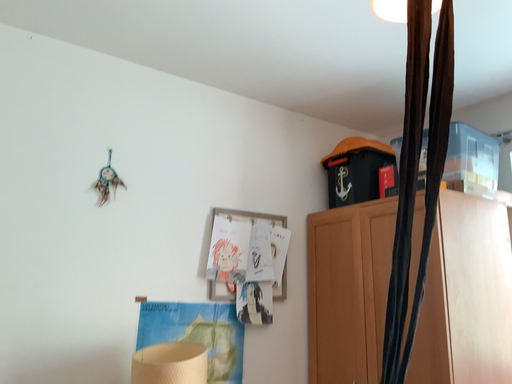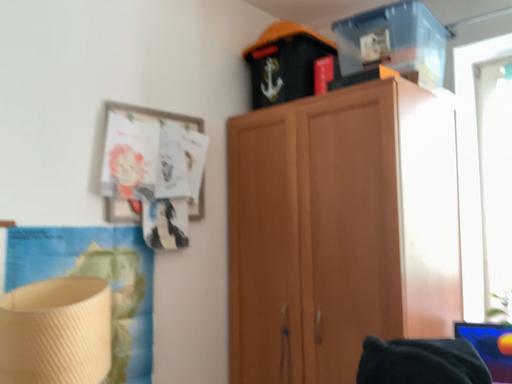
Question: Which way did the camera rotate in the video?

Choices:
 (A) rotated right
 (B) rotated left

Answer: (A)